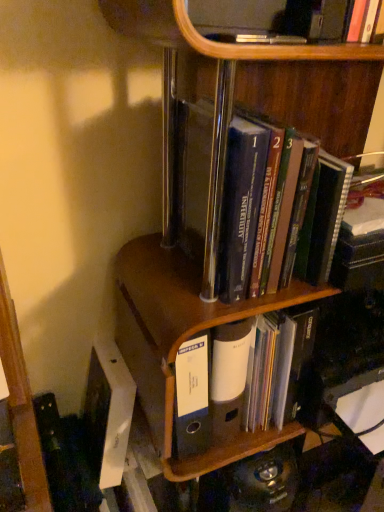
Question: From a real-world perspective, relative to hardcover books at center, the first book in the top-to-bottom sequence, is brown wood file at center vertically above or below?

Choices:
 (A) below
 (B) above

Answer: (A)

Question: From the image's perspective, relative to hardcover books at center, which appears as the second book when ordered from the bottom, is brown wood file at center above or below?

Choices:
 (A) above
 (B) below

Answer: (B)

Question: Which object is the closest to the hardcover books at center, the first book in the top-to-bottom sequence?

Choices:
 (A) brown wood file at center
 (B) white matte file folder at center, the second book positioned from the top

Answer: (A)

Question: Which of these objects is positioned closest to the hardcover books at center, which appears as the second book when ordered from the bottom?

Choices:
 (A) brown wood file at center
 (B) white matte file folder at center, the first book positioned from the bottom

Answer: (A)